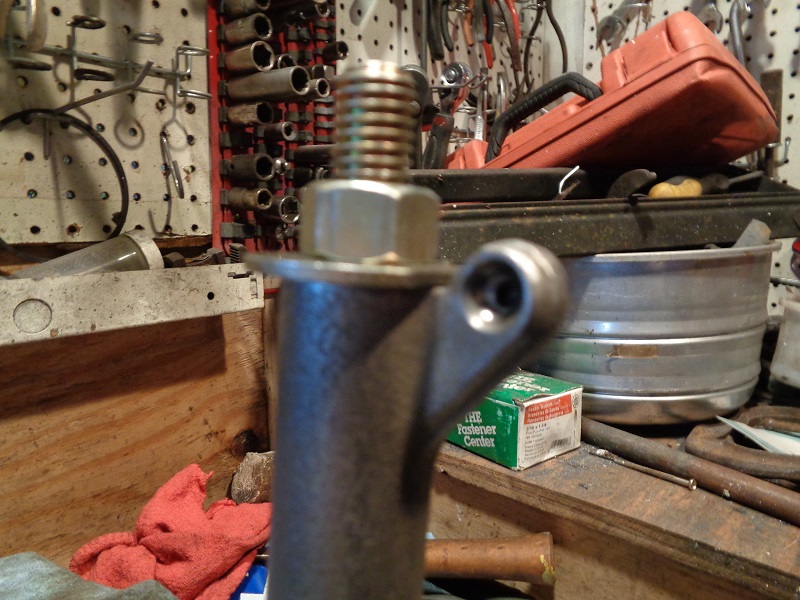
Where is `rag`? This screenshot has height=600, width=800. rag is located at coordinates (204, 552).